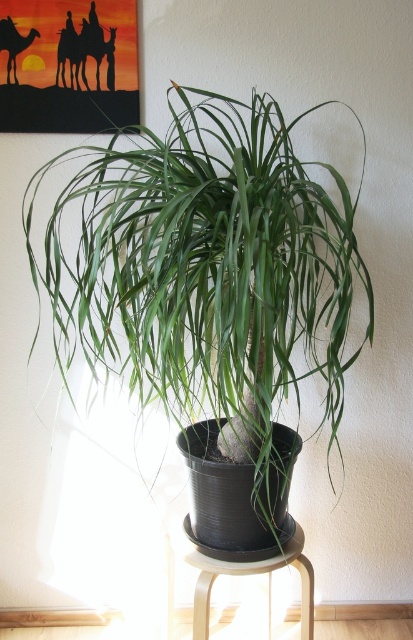
Which is below, green matte plant at center or matte black camel at upper left?

green matte plant at center is lower down.

Is green matte plant at center shorter than matte black camel at upper left?

No, green matte plant at center is not shorter than matte black camel at upper left.

Identify the location of green matte plant at center. coord(211,294).

Where is `green matte plant at center`? The width and height of the screenshot is (413, 640). green matte plant at center is located at coordinates (211, 294).

Between green matte plant at center and wooden stool at lower center, which one appears on the left side from the viewer's perspective?

Positioned to the left is green matte plant at center.

Which is behind, point (121, 307) or point (254, 573)?

Point (254, 573)

This screenshot has height=640, width=413. I want to click on green matte plant at center, so click(x=211, y=294).

Between wooden stool at lower center and matte black camel at upper left, which one appears on the right side from the viewer's perspective?

Positioned to the right is wooden stool at lower center.

I want to click on wooden stool at lower center, so click(235, 576).